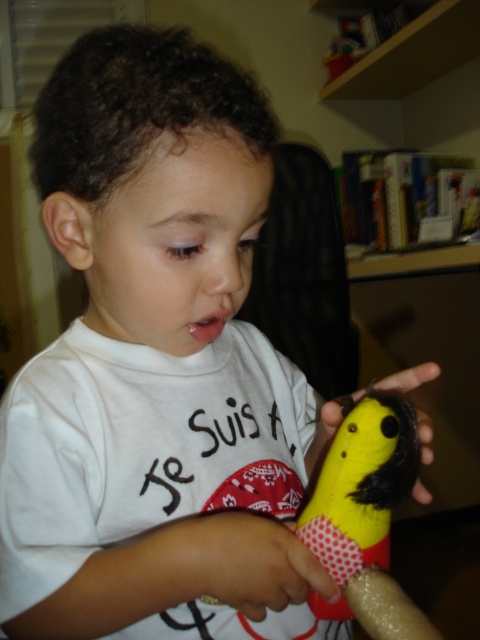
Between yellow fabric bird at center and soft yellow plush toy at center, which one appears on the left side from the viewer's perspective?

soft yellow plush toy at center

Is yellow fabric bird at center thinner than soft yellow plush toy at center?

Yes.

Does point (408, 634) lie behind point (248, 576)?

That is False.

You are a GUI agent. You are given a task and a screenshot of the screen. Output one action in this format:
    pyautogui.click(x=<x>, y=<y>)
    Task: Click on the yellow fabric bird at center
    This screenshot has width=480, height=640.
    Given the screenshot: What is the action you would take?
    pyautogui.click(x=361, y=484)

The height and width of the screenshot is (640, 480). Describe the element at coordinates (361, 484) in the screenshot. I see `yellow fabric bird at center` at that location.

Which is behind, point (395, 468) or point (337, 420)?

Point (337, 420)

Identify the location of yellow fabric bird at center. (x=361, y=484).

What do you see at coordinates (251, 563) in the screenshot? I see `soft yellow plush toy at center` at bounding box center [251, 563].

Who is positioned more to the left, soft yellow plush toy at center or yellow fabric toy at center?

Positioned to the left is soft yellow plush toy at center.

Who is more distant from viewer, (298,547) or (430,461)?

The point (430,461) is more distant.

At what (x,y) coordinates should I click in order to perform the action: click on soft yellow plush toy at center. Please return your answer as a coordinate pair (x, y). Looking at the image, I should click on (251, 563).